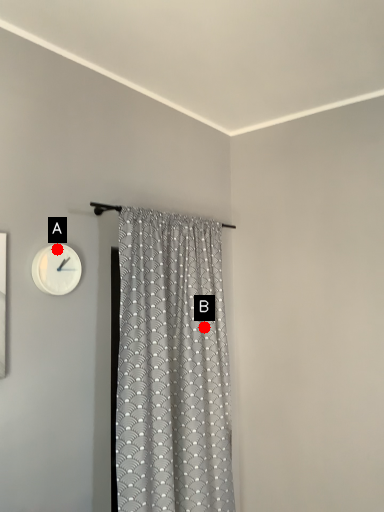
Question: Two points are circled on the image, labeled by A and B beside each circle. Among these points, which one is nearest to the camera?

Choices:
 (A) A is closer
 (B) B is closer

Answer: (A)